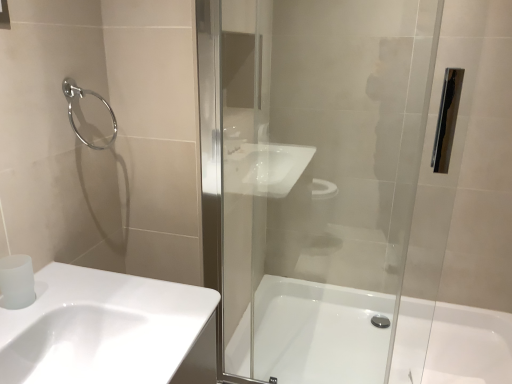
Question: From a real-world perspective, is white glossy sink at lower left positioned above or below transparent glass shower door at center?

Choices:
 (A) above
 (B) below

Answer: (B)

Question: Does point (152, 302) appear closer or farther from the camera than point (234, 355)?

Choices:
 (A) closer
 (B) farther

Answer: (A)

Question: Estimate the real-world distances between objects in this image. Which object is closer to the white glossy bathtub at center?

Choices:
 (A) transparent glass shower door at center
 (B) satin white toilet paper at lower left
 (C) chrome metallic towel ring at upper left
 (D) white glossy sink at lower left

Answer: (A)

Question: Estimate the real-world distances between objects in this image. Which object is farther from the transparent glass shower door at center?

Choices:
 (A) chrome metallic towel ring at upper left
 (B) white glossy bathtub at center
 (C) white glossy sink at lower left
 (D) satin white toilet paper at lower left

Answer: (D)